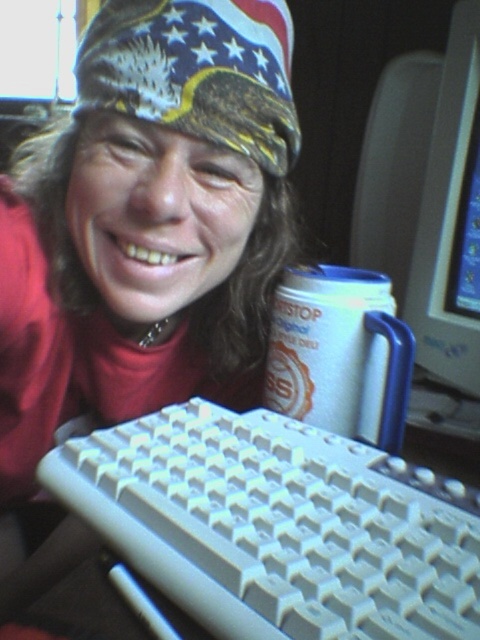
Who is positioned more to the right, matte plastic keyboard at lower center or white paper cup at center?

From the viewer's perspective, white paper cup at center appears more on the right side.

Can you confirm if matte plastic keyboard at lower center is positioned to the left of white paper cup at center?

Yes, matte plastic keyboard at lower center is to the left of white paper cup at center.

Is point (156, 125) more distant than point (328, 413)?

No, it is in front of (328, 413).

Locate an element on the screen. This screenshot has width=480, height=640. matte plastic keyboard at lower center is located at coordinates (147, 224).

Which is more to the right, matte plastic keyboard at lower center or american flag bandana at upper center?

american flag bandana at upper center is more to the right.

Based on the photo, is matte plastic keyboard at lower center thinner than american flag bandana at upper center?

In fact, matte plastic keyboard at lower center might be wider than american flag bandana at upper center.

Which is behind, point (108, 198) or point (264, 88)?

Point (108, 198)

Locate an element on the screen. The height and width of the screenshot is (640, 480). matte plastic keyboard at lower center is located at coordinates (147, 224).

Can you confirm if matte plastic keyboard at lower center is wider than matte plastic monitor at upper right?

Yes, matte plastic keyboard at lower center is wider than matte plastic monitor at upper right.

Image resolution: width=480 pixels, height=640 pixels. What do you see at coordinates (147, 224) in the screenshot?
I see `matte plastic keyboard at lower center` at bounding box center [147, 224].

What do you see at coordinates (147, 224) in the screenshot?
I see `matte plastic keyboard at lower center` at bounding box center [147, 224].

At what (x,y) coordinates should I click in order to perform the action: click on matte plastic keyboard at lower center. Please return your answer as a coordinate pair (x, y). Looking at the image, I should click on (147, 224).